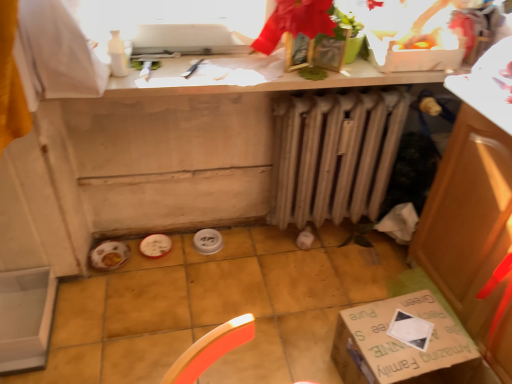
Question: From the image's perspective, is white plastic box at upper center under white matte countertop at upper center?

Choices:
 (A) no
 (B) yes

Answer: (A)

Question: From a real-world perspective, is white plastic box at upper center beneath white matte countertop at upper center?

Choices:
 (A) no
 (B) yes

Answer: (A)

Question: Could you tell me if white plastic box at upper center is turned towards white matte countertop at upper center?

Choices:
 (A) no
 (B) yes

Answer: (A)

Question: Does white plastic box at upper center have a smaller size compared to white matte countertop at upper center?

Choices:
 (A) yes
 (B) no

Answer: (A)

Question: Is white plastic box at upper center far away from white matte countertop at upper center?

Choices:
 (A) no
 (B) yes

Answer: (A)

Question: From the image's perspective, is beige metallic radiator at center located above or below white matte countertop at upper center?

Choices:
 (A) below
 (B) above

Answer: (A)

Question: Is beige metallic radiator at center inside or outside of white matte countertop at upper center?

Choices:
 (A) inside
 (B) outside

Answer: (B)

Question: Based on their positions, is beige metallic radiator at center located to the left or right of white matte countertop at upper center?

Choices:
 (A) right
 (B) left

Answer: (A)

Question: In terms of width, does beige metallic radiator at center look wider or thinner when compared to white matte countertop at upper center?

Choices:
 (A) wide
 (B) thin

Answer: (B)

Question: In terms of height, does beige metallic radiator at center look taller or shorter compared to green cardboard box at lower right?

Choices:
 (A) tall
 (B) short

Answer: (A)

Question: Is beige metallic radiator at center spatially inside green cardboard box at lower right, or outside of it?

Choices:
 (A) outside
 (B) inside

Answer: (A)

Question: In the image, is beige metallic radiator at center positioned in front of or behind green cardboard box at lower right?

Choices:
 (A) behind
 (B) front

Answer: (A)

Question: From a real-world perspective, is beige metallic radiator at center physically located above or below green cardboard box at lower right?

Choices:
 (A) above
 (B) below

Answer: (A)

Question: Relative to white plastic box at upper center, is beige metallic radiator at center in front or behind?

Choices:
 (A) behind
 (B) front

Answer: (A)

Question: From the image's perspective, is beige metallic radiator at center above or below white plastic box at upper center?

Choices:
 (A) above
 (B) below

Answer: (B)